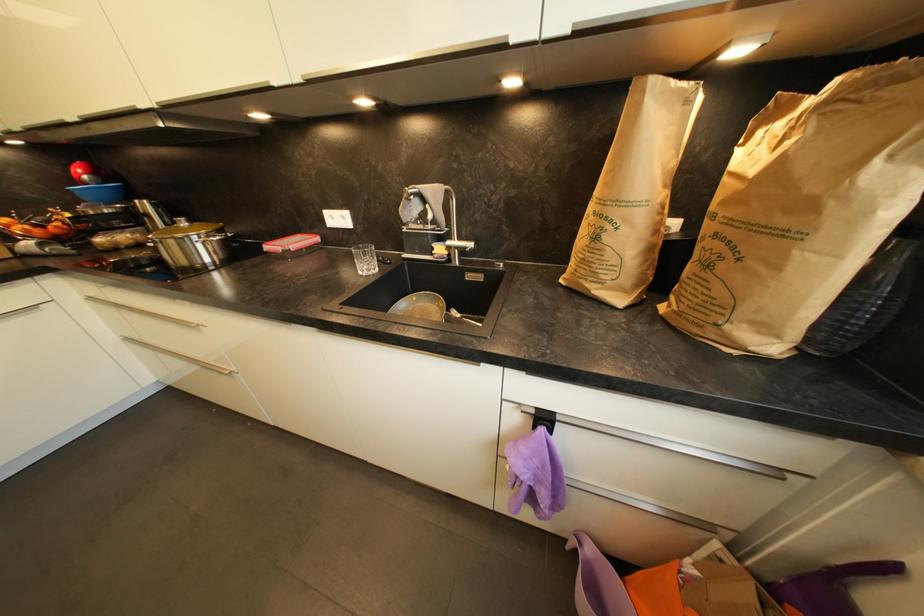
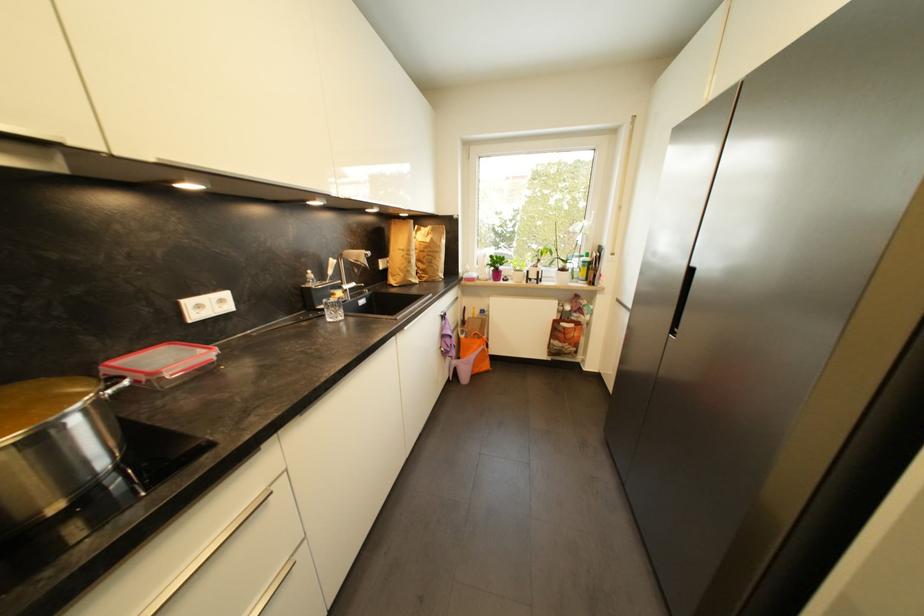
Find the pixel in the second image that matches (x=601, y=240) in the first image.

(415, 264)